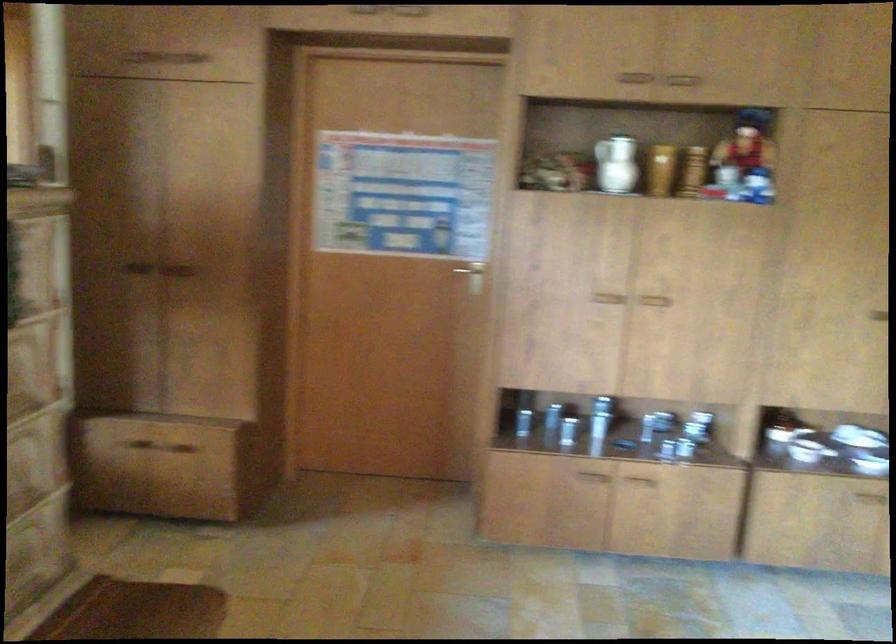
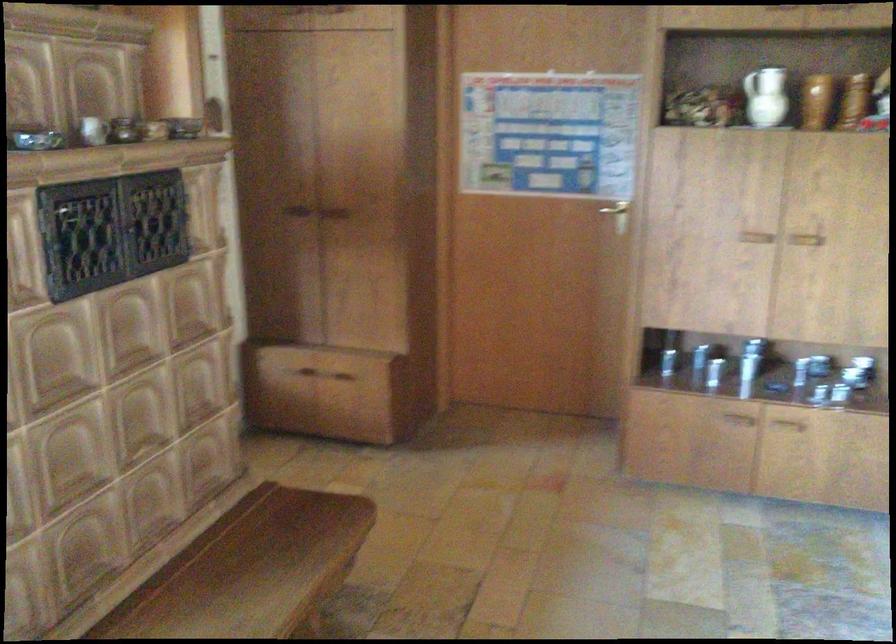
Which direction would the cameraman need to move to produce the second image?

The cameraman moved toward right, backward.